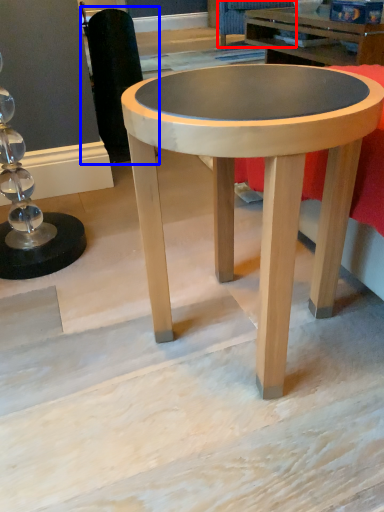
Question: Among these objects, which one is farthest to the camera, swivel chair (highlighted by a red box) or swivel chair (highlighted by a blue box)?

Choices:
 (A) swivel chair
 (B) swivel chair

Answer: (A)